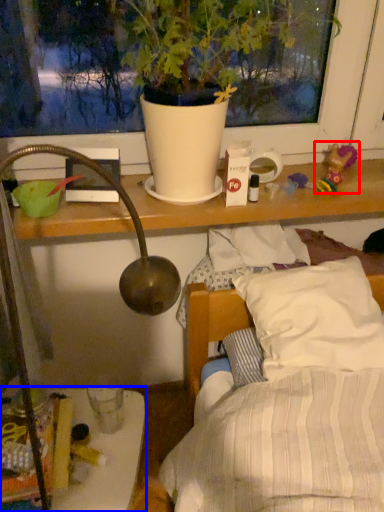
Question: Which point is further to the camera, toy (highlighted by a red box) or furniture (highlighted by a blue box)?

Choices:
 (A) toy
 (B) furniture

Answer: (A)